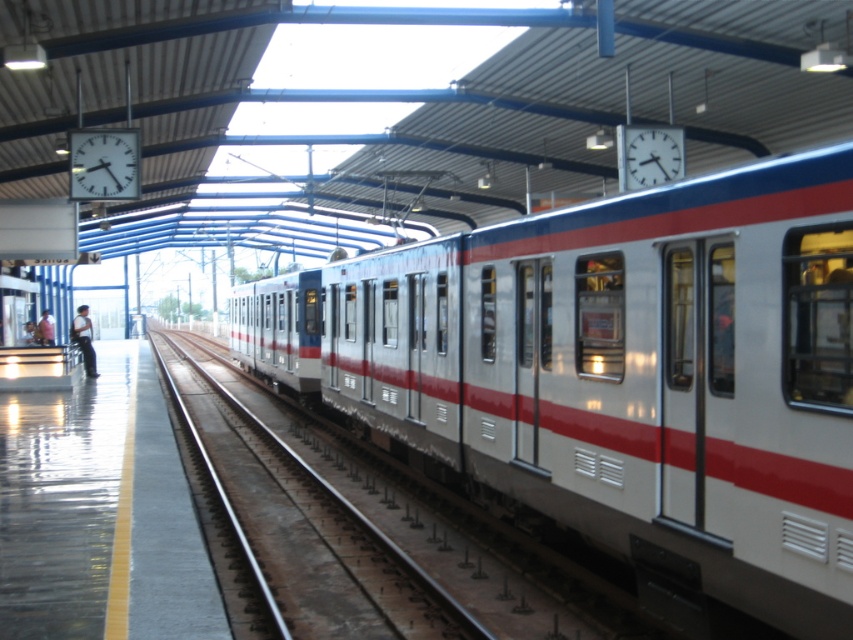
Question: Can you confirm if silver metallic train at center is smaller than light pink shirt at left?

Choices:
 (A) yes
 (B) no

Answer: (B)

Question: Is light blue jeans at left wider than light pink shirt at left?

Choices:
 (A) no
 (B) yes

Answer: (A)

Question: Which of the following is the closest to the observer?

Choices:
 (A) (85, 342)
 (B) (466, 410)
 (C) (415, 595)

Answer: (C)

Question: Among these objects, which one is farthest from the camera?

Choices:
 (A) light blue jeans at left
 (B) metallic track at center

Answer: (A)

Question: Is metallic track at center wider than light pink shirt at left?

Choices:
 (A) no
 (B) yes

Answer: (B)

Question: Which is nearer to the silver metallic train at center?

Choices:
 (A) metallic track at center
 (B) light blue jeans at left
 (C) light pink shirt at left

Answer: (A)